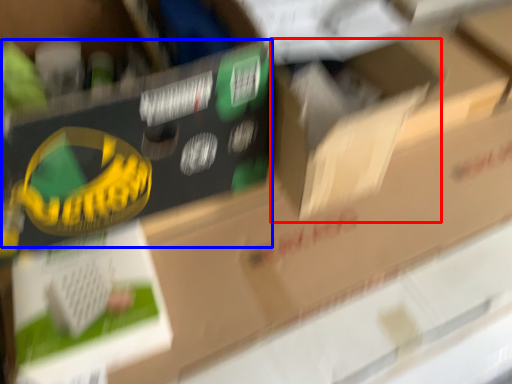
Question: Among these objects, which one is farthest to the camera, cardboard box (highlighted by a red box) or storage box (highlighted by a blue box)?

Choices:
 (A) cardboard box
 (B) storage box

Answer: (A)